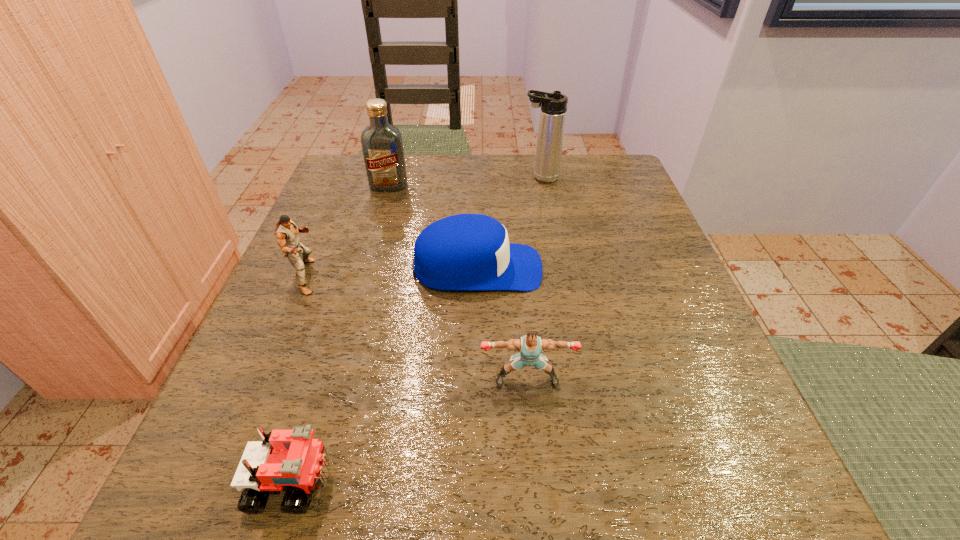
Identify the location of free space located on the handle side of the thermos bottle. The image size is (960, 540). (353, 178).

I want to click on vacant point located 0.270m on the front-facing side of the vodka, so click(x=364, y=273).

Image resolution: width=960 pixels, height=540 pixels. Find the location of `vacant point located 0.310m on the front-facing side of the leftmost object`. vacant point located 0.310m on the front-facing side of the leftmost object is located at coordinates (492, 276).

Where is `vacant region located on the front-facing side of the nearer puncher`? This screenshot has width=960, height=540. vacant region located on the front-facing side of the nearer puncher is located at coordinates (536, 474).

Locate an element on the screen. Image resolution: width=960 pixels, height=540 pixels. vacant space located on the front-facing side of the baseball cap is located at coordinates (671, 268).

At what (x,y) coordinates should I click in order to perform the action: click on vacant space situated 0.360m on the front-facing side of the nearest object. Please return your answer as a coordinate pair (x, y). The width and height of the screenshot is (960, 540). Looking at the image, I should click on (629, 481).

The image size is (960, 540). Find the location of `thermos bottle located at the far edge`. thermos bottle located at the far edge is located at coordinates (553, 111).

Locate an element on the screen. The height and width of the screenshot is (540, 960). vodka that is at the far edge is located at coordinates (382, 145).

You are a GUI agent. You are given a task and a screenshot of the screen. Output one action in this format:
    pyautogui.click(x=<x>, y=<y>)
    Task: Click on the object located in the near edge section of the desktop
    This screenshot has width=960, height=540.
    Given the screenshot: What is the action you would take?
    pyautogui.click(x=286, y=458)

Image resolution: width=960 pixels, height=540 pixels. I want to click on vodka at the left edge, so click(382, 145).